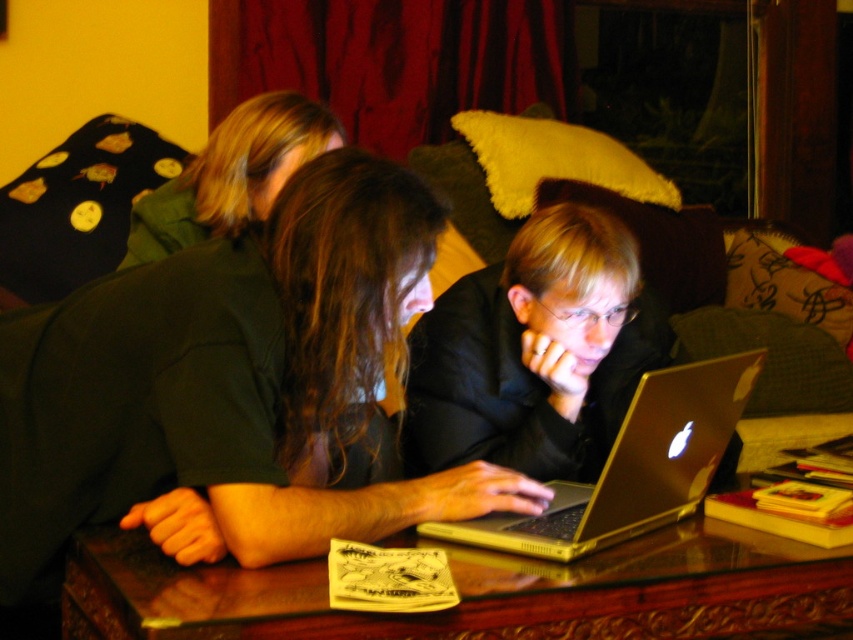
Question: Considering the real-world distances, which object is farthest from the matte black laptop at center?

Choices:
 (A) velvet green couch at center
 (B) wooden table at center

Answer: (A)

Question: Can you confirm if velvet green couch at center is wider than metallic gold laptop at center?

Choices:
 (A) yes
 (B) no

Answer: (A)

Question: Which object is farther from the camera taking this photo?

Choices:
 (A) velvet green couch at center
 (B) dark green shirt at center

Answer: (B)

Question: Is matte black laptop at center positioned at the back of wooden table at center?

Choices:
 (A) no
 (B) yes

Answer: (B)

Question: Can you confirm if wooden table at center is positioned above velvet green couch at center?

Choices:
 (A) yes
 (B) no

Answer: (B)

Question: Which object appears closest to the camera in this image?

Choices:
 (A) velvet green couch at center
 (B) matte black laptop at center

Answer: (B)